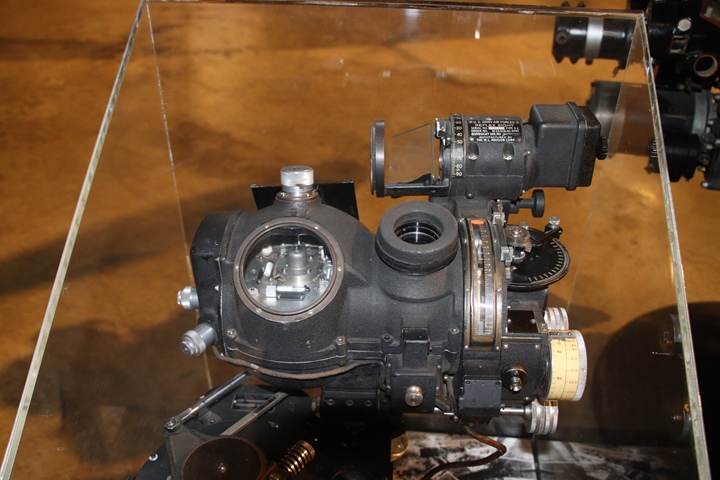
Where is `base of stand`? Image resolution: width=720 pixels, height=480 pixels. base of stand is located at coordinates (705, 332).